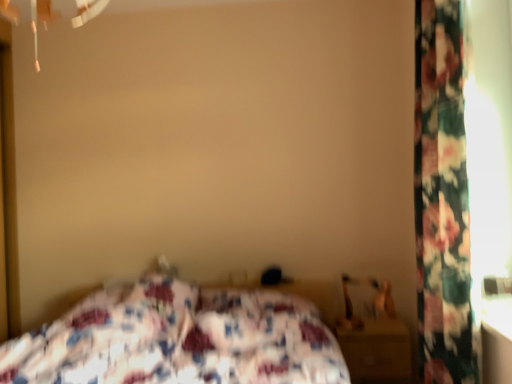
Question: Is wooden nightstand at lower right to the left or to the right of floral fabric bed at center in the image?

Choices:
 (A) left
 (B) right

Answer: (B)

Question: Do you think wooden nightstand at lower right is within floral fabric bed at center, or outside of it?

Choices:
 (A) outside
 (B) inside

Answer: (A)

Question: Which object is the closest to the floral fabric bed at center?

Choices:
 (A) wooden nightstand at lower right
 (B) floral fabric curtain at right

Answer: (A)

Question: Considering the real-world distances, which object is closest to the floral fabric bed at center?

Choices:
 (A) floral fabric curtain at right
 (B) wooden nightstand at lower right

Answer: (B)